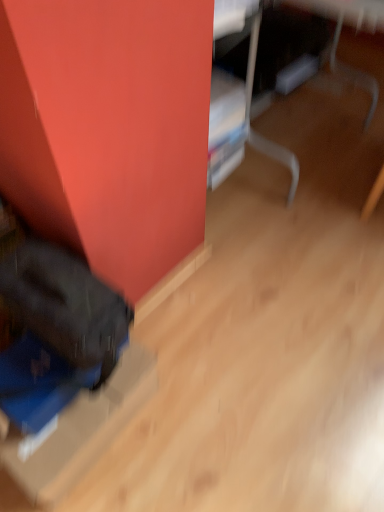
Question: From the image's perspective, is matte black bag at lower left on blue cardboard box at lower left?

Choices:
 (A) no
 (B) yes

Answer: (B)

Question: Is matte black bag at lower left positioned behind blue cardboard box at lower left?

Choices:
 (A) yes
 (B) no

Answer: (B)

Question: Would you say matte black bag at lower left is a long distance from blue cardboard box at lower left?

Choices:
 (A) yes
 (B) no

Answer: (B)

Question: Is matte black bag at lower left bigger than blue cardboard box at lower left?

Choices:
 (A) yes
 (B) no

Answer: (A)

Question: Does matte black bag at lower left appear on the right side of blue cardboard box at lower left?

Choices:
 (A) yes
 (B) no

Answer: (A)

Question: From a real-world perspective, is matte black bag at lower left below blue cardboard box at lower left?

Choices:
 (A) yes
 (B) no

Answer: (A)

Question: Is blue cardboard box at lower left further to the viewer compared to matte black bag at lower left?

Choices:
 (A) yes
 (B) no

Answer: (A)

Question: Is blue cardboard box at lower left thinner than matte black bag at lower left?

Choices:
 (A) yes
 (B) no

Answer: (A)

Question: Is blue cardboard box at lower left located outside matte black bag at lower left?

Choices:
 (A) yes
 (B) no

Answer: (A)

Question: Considering the relative positions of blue cardboard box at lower left and matte black bag at lower left in the image provided, is blue cardboard box at lower left in front of matte black bag at lower left?

Choices:
 (A) yes
 (B) no

Answer: (B)

Question: From the image's perspective, is blue cardboard box at lower left under matte black bag at lower left?

Choices:
 (A) yes
 (B) no

Answer: (A)

Question: Is blue cardboard box at lower left positioned with its back to matte black bag at lower left?

Choices:
 (A) no
 (B) yes

Answer: (A)

Question: From the image's perspective, is blue cardboard box at lower left located above or below matte black bag at lower left?

Choices:
 (A) below
 (B) above

Answer: (A)